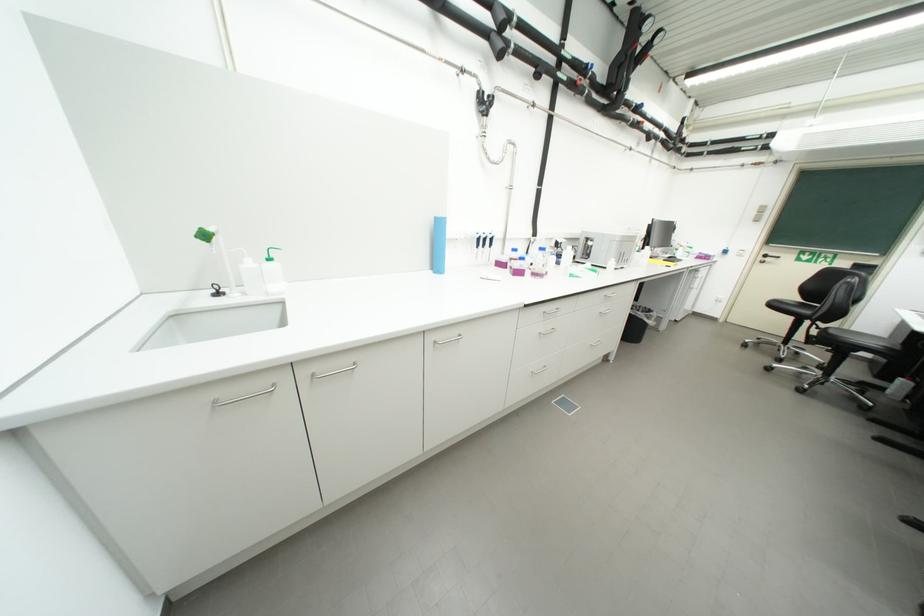
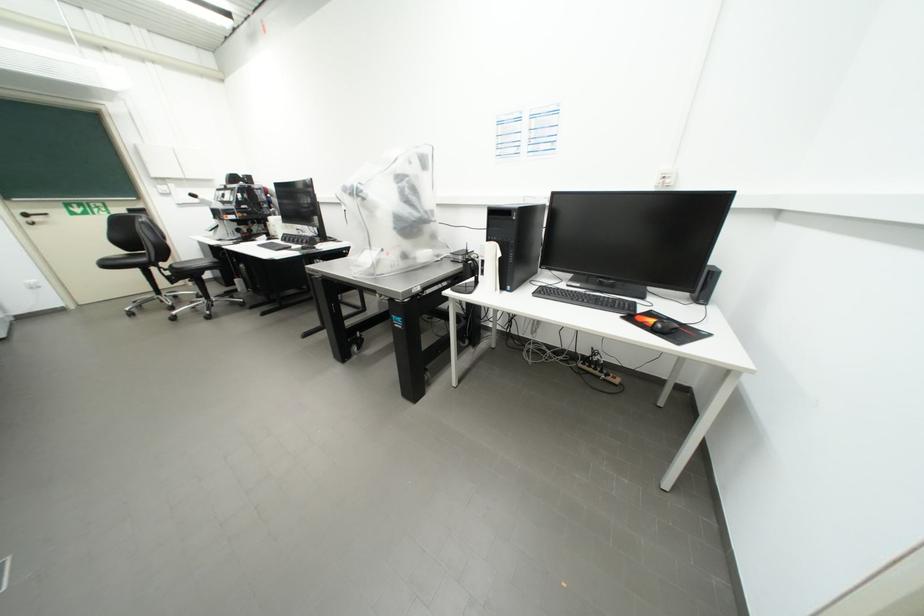
Where in the second image is the point corresponding to the point at 775,261 from the first image?

(43, 220)